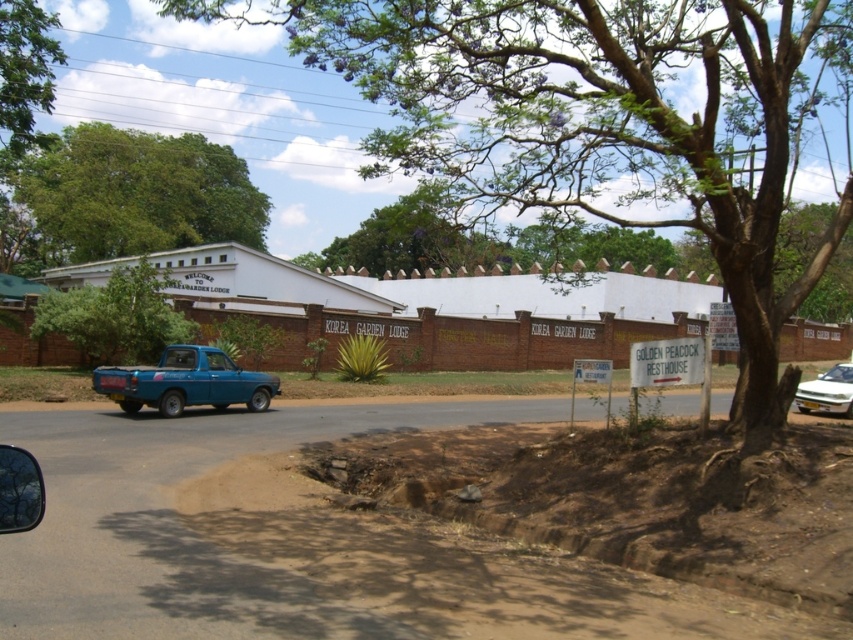
Can you confirm if green leafy tree at center is positioned above matte blue pickup truck at left?

Correct, green leafy tree at center is located above matte blue pickup truck at left.

Describe the element at coordinates (115, 316) in the screenshot. The width and height of the screenshot is (853, 640). I see `green leafy tree at center` at that location.

What do you see at coordinates (115, 316) in the screenshot?
I see `green leafy tree at center` at bounding box center [115, 316].

This screenshot has height=640, width=853. Identify the location of green leafy tree at center. (115, 316).

Does green leafy tree at upper center lie behind green leafy tree at center?

No, green leafy tree at upper center is closer to the viewer.

Where is `green leafy tree at upper center`? The width and height of the screenshot is (853, 640). green leafy tree at upper center is located at coordinates (602, 120).

This screenshot has height=640, width=853. Describe the element at coordinates (602, 120) in the screenshot. I see `green leafy tree at upper center` at that location.

Identify the location of green leafy tree at upper center. (602, 120).

Can you confirm if green leafy tree at center is positioned below white glossy car at right?

Incorrect, green leafy tree at center is not positioned below white glossy car at right.

Does green leafy tree at center appear over white glossy car at right?

Indeed, green leafy tree at center is positioned over white glossy car at right.

Is point (140, 308) closer to viewer compared to point (828, 372)?

Yes, point (140, 308) is closer to viewer.

Where is `green leafy tree at center`? green leafy tree at center is located at coordinates (115, 316).